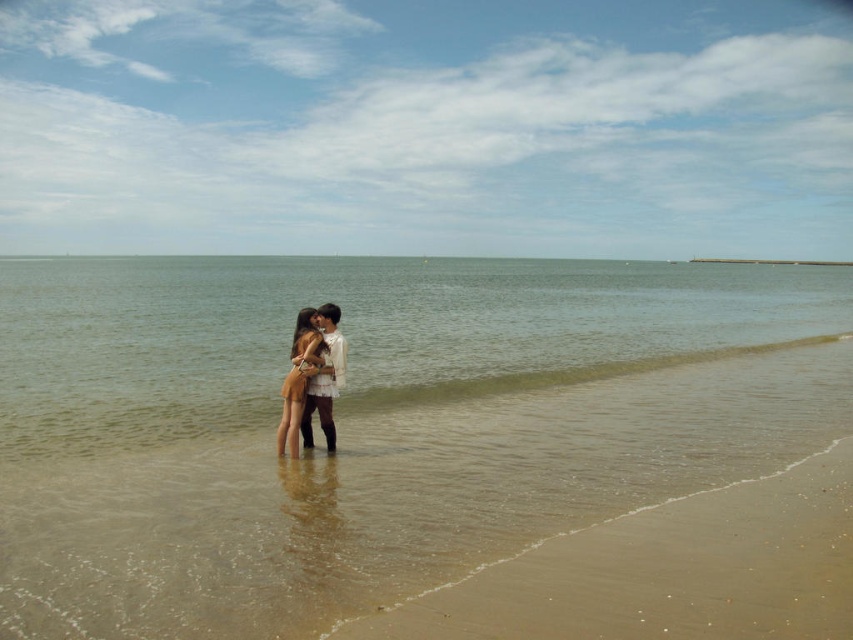
You are standing on the beach and see two points marked on the sand. The first point is at coordinates point [579,371] and the second is at point [318,360]. If you want to reach the point that is closer to you, which one should you go to?

You should go to point [318,360] because it is closer to you than point [579,371].

You are a photographer trying to capture a silhouette of the smooth sand beach at center and the matte beige dress at center. Since the sun is setting behind them, which object will appear darker in the photo?

The smooth sand beach at center will appear darker in the photo because it is not as tall as the matte beige dress at center, meaning it receives less direct sunlight and casts a longer shadow.